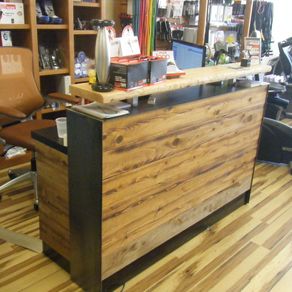
You are a GUI agent. You are given a task and a screenshot of the screen. Output one action in this format:
    pyautogui.click(x=<x>, y=<y>)
    Task: Click on the shelving unit behind desk
    The image size is (292, 292).
    Given the screenshot: What is the action you would take?
    pyautogui.click(x=71, y=33), pyautogui.click(x=36, y=52)